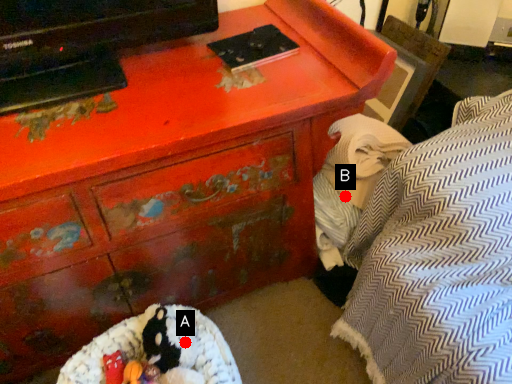
Question: Two points are circled on the image, labeled by A and B beside each circle. Which point is closer to the camera?

Choices:
 (A) A is closer
 (B) B is closer

Answer: (A)